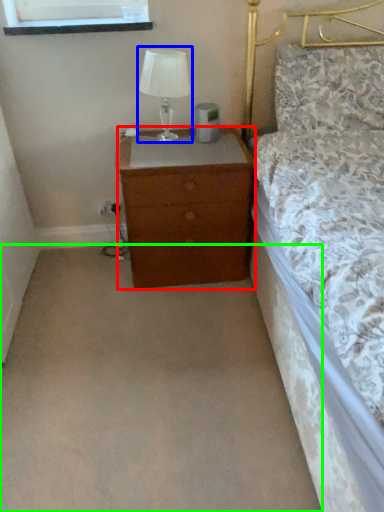
Question: Which is farther away from chest of drawers (highlighted by a red box)? table lamp (highlighted by a blue box) or plain (highlighted by a green box)?

Choices:
 (A) table lamp
 (B) plain

Answer: (B)